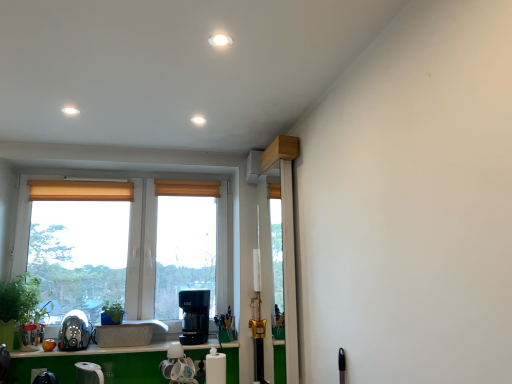
The width and height of the screenshot is (512, 384). I want to click on vacant space underneath green matte plant at center, positioned as the second plant in left-to-right order (from a real-world perspective), so click(x=111, y=323).